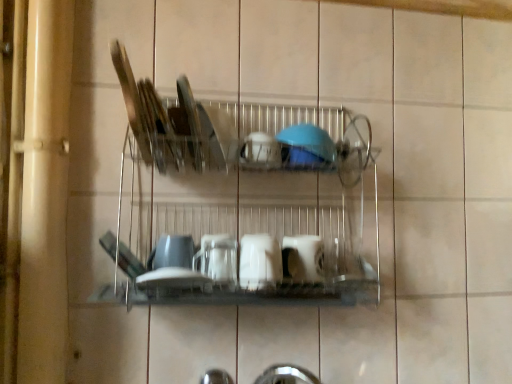
Question: Relative to blue glossy bowl at center, the 3th tableware from the top, is clear glass plate at center, the 1th tableware when ordered from top to bottom, in front or behind?

Choices:
 (A) behind
 (B) front

Answer: (B)

Question: From the image's perspective, is clear glass plate at center, the 6th tableware from the bottom, positioned above or below blue glossy bowl at center, the 3th tableware from the top?

Choices:
 (A) below
 (B) above

Answer: (B)

Question: Estimate the real-world distances between objects in this image. Which object is farther from the blue glossy bowl at center, the 3th tableware from the top?

Choices:
 (A) blue matte bowl at upper center, the second tableware when ordered from top to bottom
 (B) clear glass plate at center, the 6th tableware from the bottom
 (C) white glossy cup at center, the third tableware in the bottom-to-top sequence
 (D) matte white cup at center, the 5th tableware from the top
 (E) metallic silver dish rack at center

Answer: (D)

Question: Estimate the real-world distances between objects in this image. Which object is farther from the white glossy cup at center, which is the 4th tableware in top-to-bottom order?

Choices:
 (A) metallic silver dish rack at center
 (B) clear glass plate at center, the 1th tableware when ordered from top to bottom
 (C) white glossy cup at center, which is the 1th tableware from bottom to top
 (D) matte white cup at center, which ranks as the second tableware in bottom-to-top order
 (E) blue glossy bowl at center, the 3th tableware from the top

Answer: (B)